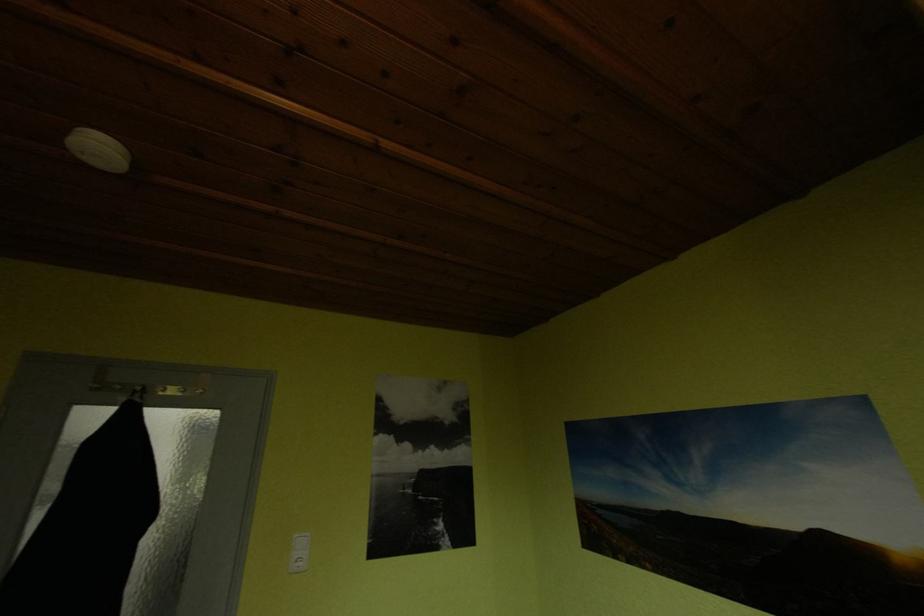
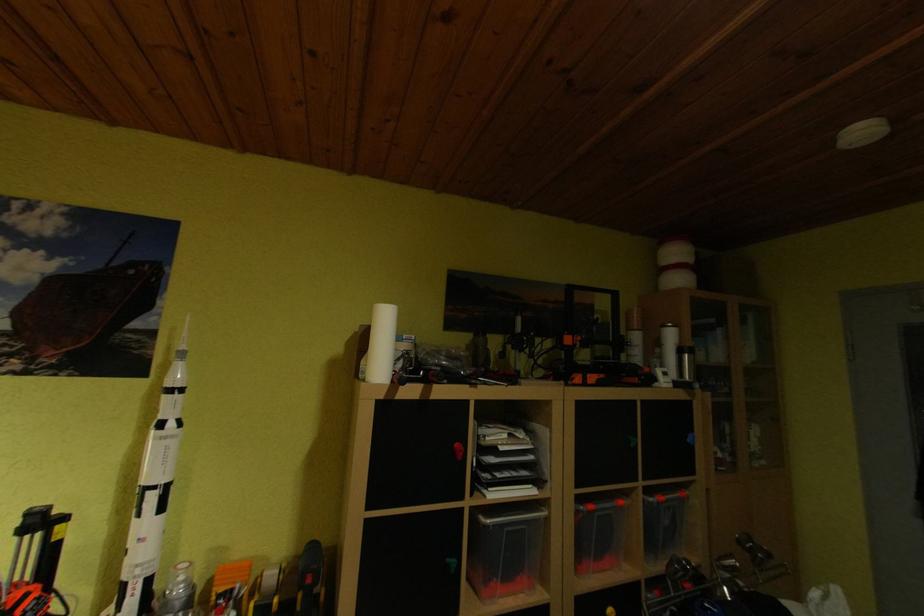
Question: Based on the continuous images, in which direction is the camera rotating? Reply with the corresponding letter.

Choices:
 (A) Left
 (B) Right
 (C) Up
 (D) Down

Answer: (A)